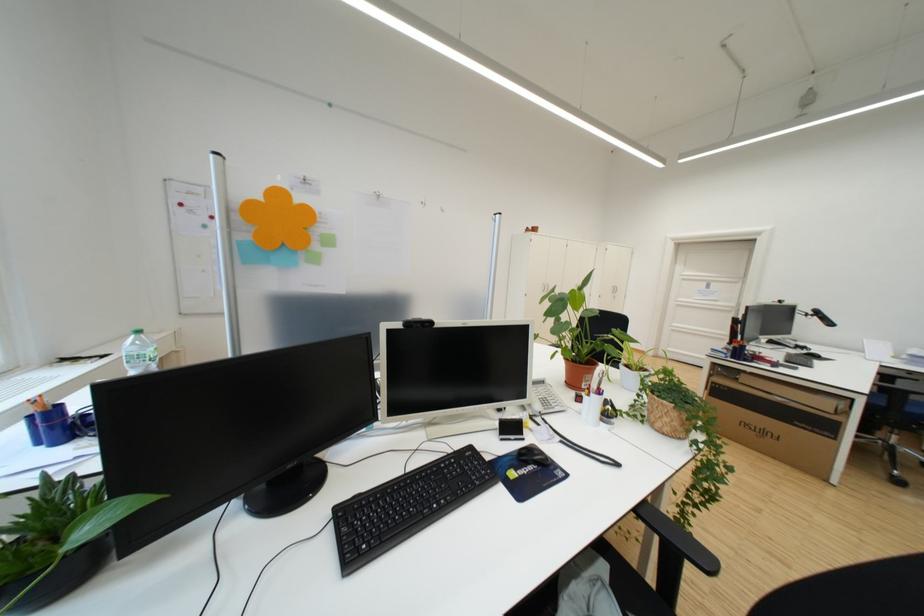
The image size is (924, 616). What do you see at coordinates (528, 452) in the screenshot?
I see `the mouse scroll wheel` at bounding box center [528, 452].